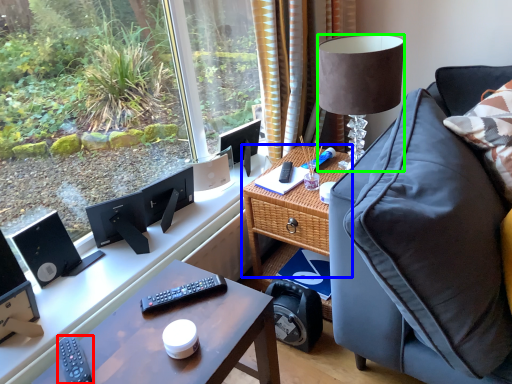
Question: Considering the real-world distances, which object is closest to remote control (highlighted by a red box)? table (highlighted by a blue box) or lamp (highlighted by a green box).

Choices:
 (A) table
 (B) lamp

Answer: (A)